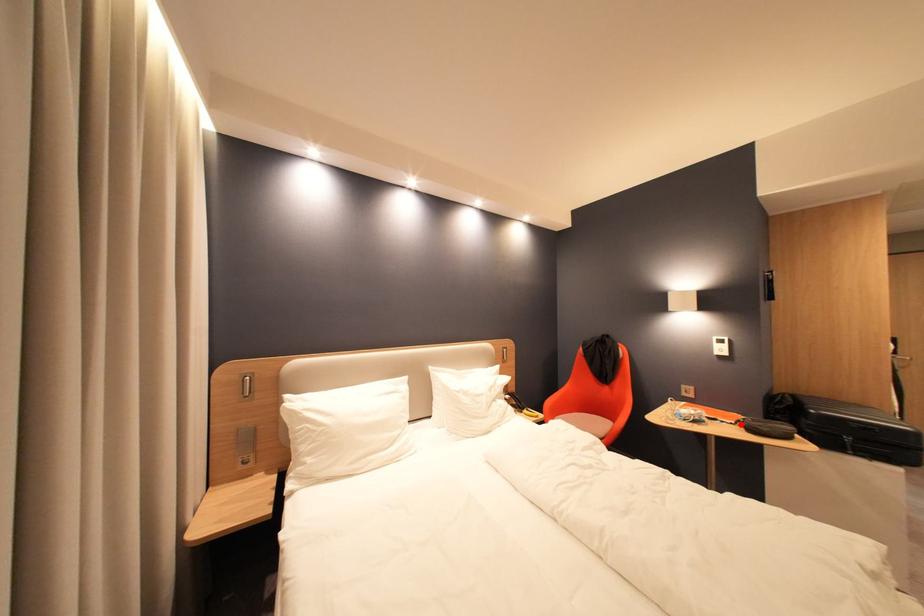
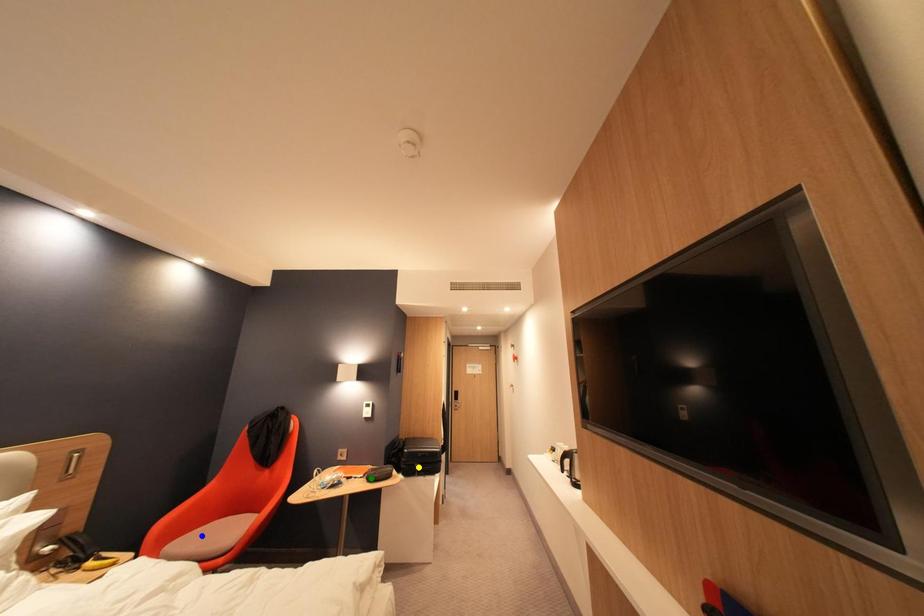
Question: I am providing you with two images of the same scene from different viewpoints. A red point is marked on the first image. You are given multiple points on the second image. Can you choose the point in image 2 that corresponds to the point in image 1?

Choices:
 (A) blue point
 (B) yellow point
 (C) green point

Answer: (C)